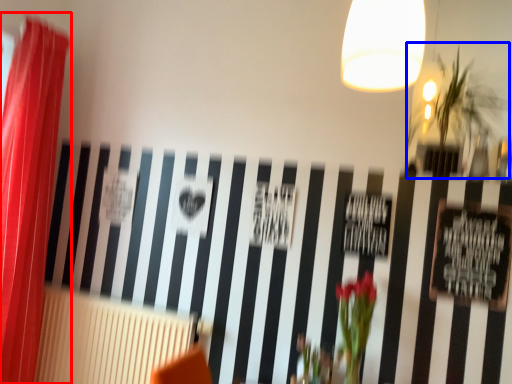
Question: Which object appears farthest to the camera in this image, curtain (highlighted by a red box) or plant (highlighted by a blue box)?

Choices:
 (A) curtain
 (B) plant

Answer: (A)